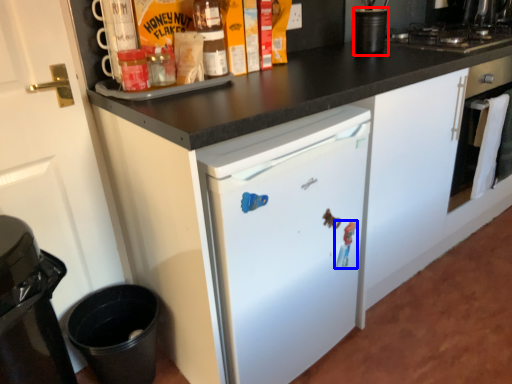
Question: Among these objects, which one is farthest to the camera, appliance (highlighted by a red box) or toy (highlighted by a blue box)?

Choices:
 (A) appliance
 (B) toy

Answer: (A)